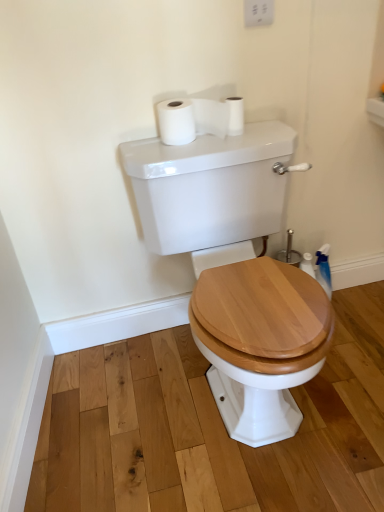
You are a GUI agent. You are given a task and a screenshot of the screen. Output one action in this format:
    pyautogui.click(x=<x>, y=<y>)
    Task: Click on the free space to the right of white matte toilet paper at upper center, which is the first toilet paper from left to right
    
    Given the screenshot: What is the action you would take?
    pyautogui.click(x=256, y=132)